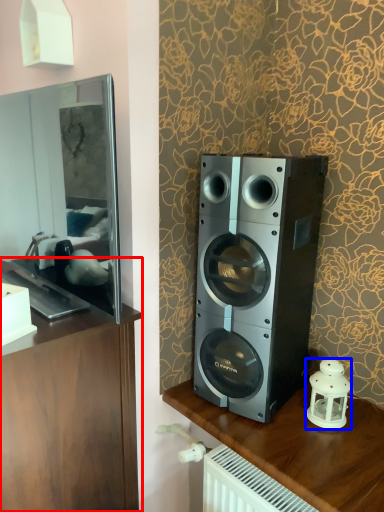
Question: Among these objects, which one is nearest to the camera, furniture (highlighted by a red box) or candle holder (highlighted by a blue box)?

Choices:
 (A) furniture
 (B) candle holder

Answer: (A)